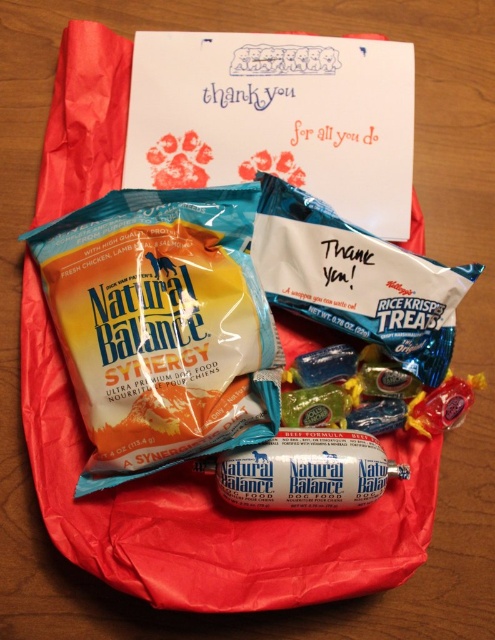
You are standing 5 feet away from the wooden surface where the items are arranged. You want to pick up the blue matte bag of natural balance synergy at upper left. Can you reach it without moving closer?

The blue matte bag of natural balance synergy at upper left is 3.87 feet away from the viewer. Since you are standing 5 feet away, it is farther than your reach. You need to move closer to pick it up.

You are organizing a gift basket and need to place the blue matte bag of natural balance synergy at upper left and the white glossy dog food at center. If you want to stack them vertically, which one should go on the bottom to ensure stability?

The blue matte bag of natural balance synergy at upper left is taller than the white glossy dog food at center, so placing the taller blue matte bag of natural balance synergy at upper left at the bottom would provide a stable base for stacking.

You are organizing a gift basket for a dog owner and have a blue matte bag of natural balance synergy at upper left and a white glossy dog food at center. Which item takes up more space in the basket?

The blue matte bag of natural balance synergy at upper left is bigger than the white glossy dog food at center, so it takes up more space in the basket.